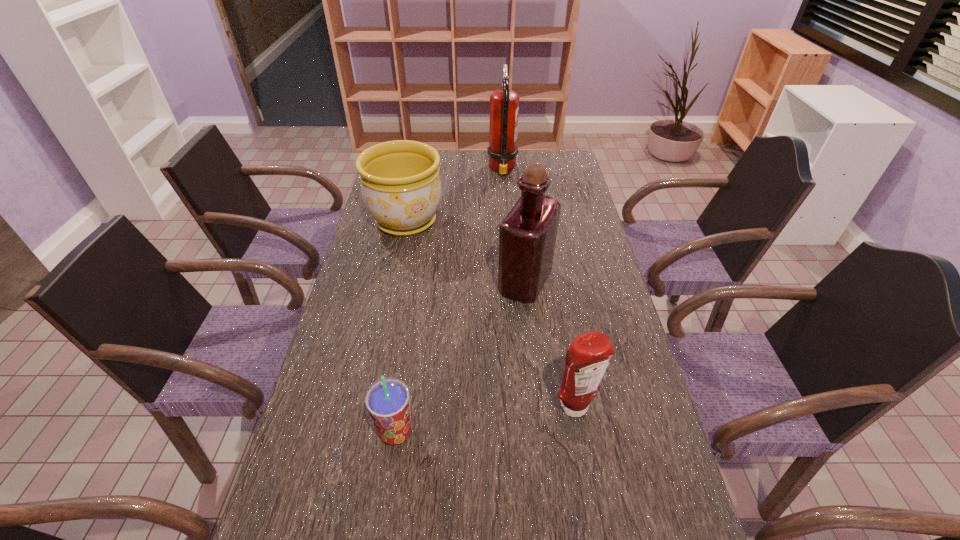
You are a GUI agent. You are given a task and a screenshot of the screen. Output one action in this format:
    pyautogui.click(x=<x>, y=<y>)
    Task: Click on the free spot located on the right of the condiment
    Image resolution: width=960 pixels, height=540 pixels.
    Given the screenshot: What is the action you would take?
    pyautogui.click(x=636, y=407)

Where is `free location located 0.330m on the right of the smoothie`? This screenshot has height=540, width=960. free location located 0.330m on the right of the smoothie is located at coordinates (564, 433).

Where is `object that is at the far edge`? This screenshot has width=960, height=540. object that is at the far edge is located at coordinates (x=504, y=104).

The width and height of the screenshot is (960, 540). Find the location of `object present at the left edge`. object present at the left edge is located at coordinates (401, 187).

At what (x,y) coordinates should I click in order to perform the action: click on object present at the right edge. Please return your answer as a coordinate pair (x, y). The width and height of the screenshot is (960, 540). Looking at the image, I should click on (589, 354).

Locate an element on the screen. Image resolution: width=960 pixels, height=540 pixels. vacant space at the left edge of the desktop is located at coordinates (391, 245).

What are the coordinates of `free point at the right edge` in the screenshot? It's located at (564, 229).

Where is `free spot between the liquor and the smoothie`? The height and width of the screenshot is (540, 960). free spot between the liquor and the smoothie is located at coordinates (461, 357).

The height and width of the screenshot is (540, 960). Identify the location of unoccupied area between the farthest object and the smoothie. pyautogui.click(x=449, y=301).

In order to click on vacant area that lies between the fourth nearest object and the fire extinguisher in this screenshot , I will do `click(454, 195)`.